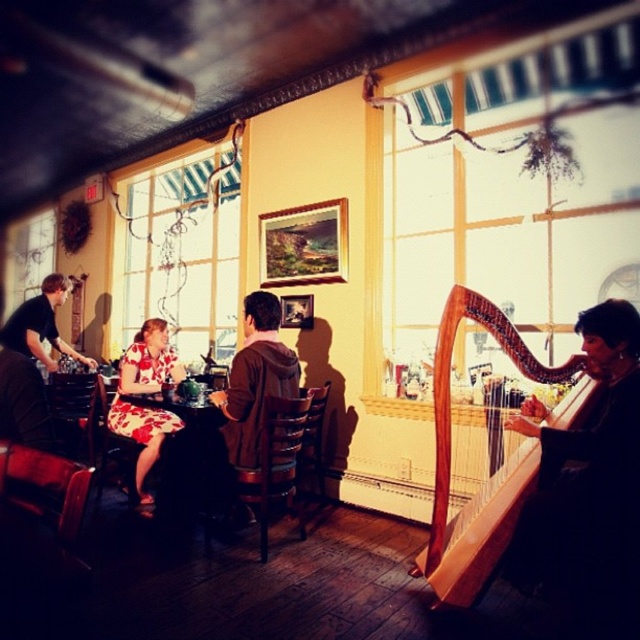
Question: Considering the relative positions of wooden harp at right and wooden table at center in the image provided, where is wooden harp at right located with respect to wooden table at center?

Choices:
 (A) right
 (B) left

Answer: (A)

Question: Estimate the real-world distances between objects in this image. Which object is farther from the wooden harp at right?

Choices:
 (A) black leather jacket at left
 (B) brown hoodie at center

Answer: (A)

Question: Among these objects, which one is farthest from the camera?

Choices:
 (A) brown hoodie at center
 (B) black leather jacket at left
 (C) floral dress at center

Answer: (B)

Question: Where is brown hoodie at center located in relation to wooden table at center in the image?

Choices:
 (A) right
 (B) left

Answer: (A)

Question: In this image, where is wooden harp at right located relative to wooden table at center?

Choices:
 (A) below
 (B) above

Answer: (B)

Question: Which point is farther to the camera?

Choices:
 (A) (440, 445)
 (B) (180, 445)
 (C) (259, 419)

Answer: (B)